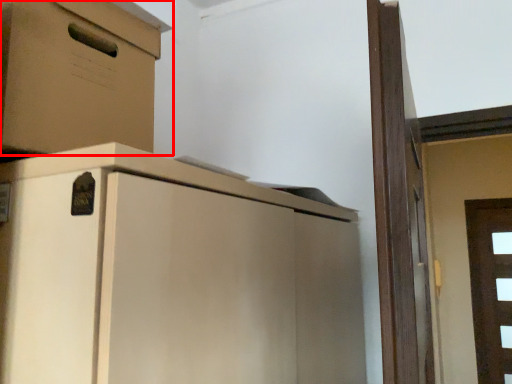
Question: From the image, what is the correct spatial relationship of cabinetry (annotated by the red box) in relation to door?

Choices:
 (A) left
 (B) right

Answer: (A)